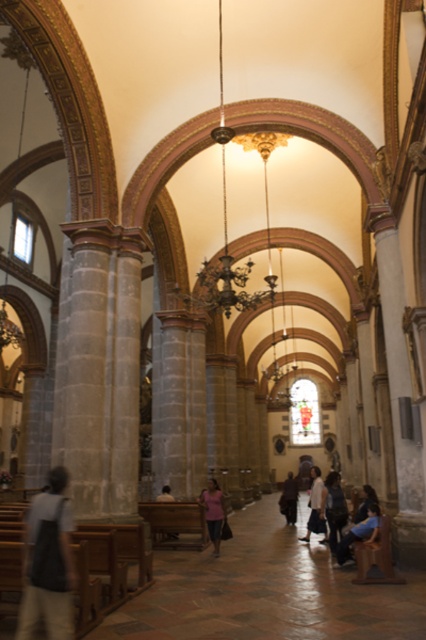
Question: Is pink matte shirt at center above white cotton shirt at center?

Choices:
 (A) yes
 (B) no

Answer: (A)

Question: Is white cotton shirt at center to the left of dark blue shirt at lower right from the viewer's perspective?

Choices:
 (A) no
 (B) yes

Answer: (A)

Question: Does light gray fabric shirt at lower left lie behind pink fabric at center?

Choices:
 (A) no
 (B) yes

Answer: (A)

Question: Which object is the closest to the dark blue shirt at lower right?

Choices:
 (A) light gray fabric shirt at lower left
 (B) dark brown leather jacket at center

Answer: (B)

Question: Which point is closer to the camera taking this photo?

Choices:
 (A) (333, 484)
 (B) (322, 524)
 (C) (377, 528)

Answer: (C)

Question: Which of these objects is positioned closest to the white cotton shirt at center?

Choices:
 (A) dark blue shirt at lower right
 (B) pink fabric at center

Answer: (A)